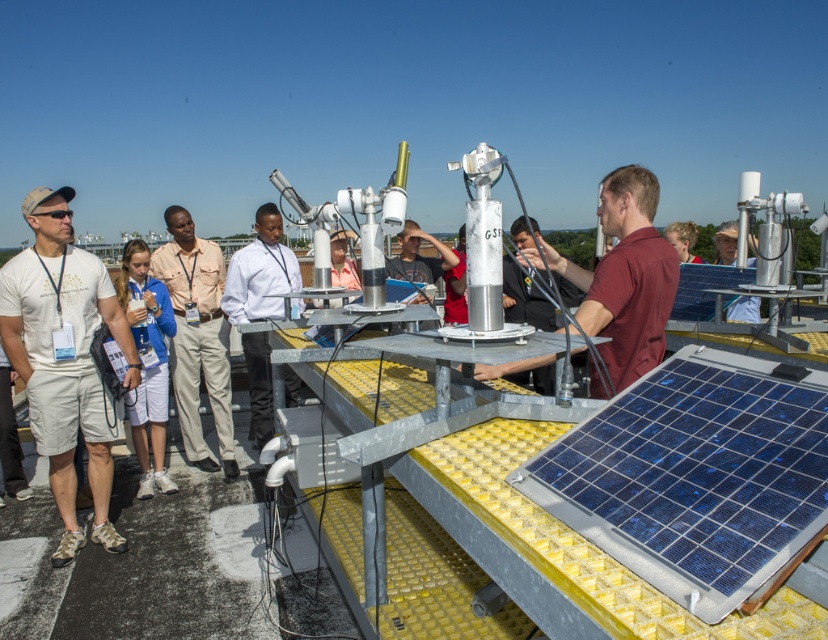
You are a photographer trying to capture a clear image of the two people in the scene. You notice that the white shirt at center and the matte gray shirt at center are positioned in a way that might cause some confusion in the photo. Which shirt is positioned to the left side of the other?

The white shirt at center is to the left of the matte gray shirt at center.

You are a researcher standing on the rooftop platform and need to place a 1.5 meter long tool between the white shirt at center and the matte gray shirt at center. Can the tool fit between them without bending?

The distance between the white shirt at center and the matte gray shirt at center is 1.39 meters, so the 1.5 meter long tool cannot fit between them without bending.